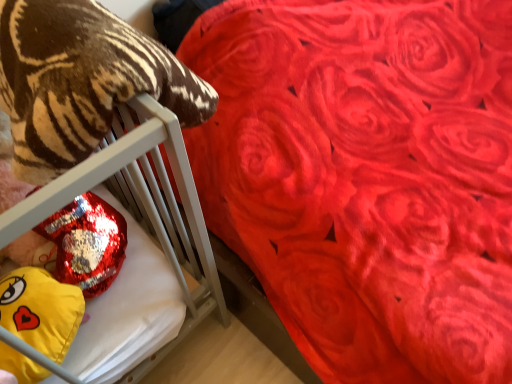
Question: From a real-world perspective, is yellow plush at left below soft plush tiger at left?

Choices:
 (A) yes
 (B) no

Answer: (A)

Question: Is yellow plush at left thinner than soft plush tiger at left?

Choices:
 (A) no
 (B) yes

Answer: (B)

Question: From the image's perspective, would you say yellow plush at left is positioned over soft plush tiger at left?

Choices:
 (A) no
 (B) yes

Answer: (A)

Question: Could you tell me if yellow plush at left is facing soft plush tiger at left?

Choices:
 (A) yes
 (B) no

Answer: (B)

Question: Can you confirm if yellow plush at left is bigger than soft plush tiger at left?

Choices:
 (A) yes
 (B) no

Answer: (B)

Question: From a real-world perspective, is soft plush tiger at left positioned above or below yellow plush at left?

Choices:
 (A) above
 (B) below

Answer: (A)

Question: Looking at their shapes, would you say soft plush tiger at left is wider or thinner than yellow plush at left?

Choices:
 (A) thin
 (B) wide

Answer: (B)

Question: In terms of size, does soft plush tiger at left appear bigger or smaller than yellow plush at left?

Choices:
 (A) small
 (B) big

Answer: (B)

Question: Considering the relative positions of soft plush tiger at left and yellow plush at left in the image provided, is soft plush tiger at left to the left or to the right of yellow plush at left?

Choices:
 (A) right
 (B) left

Answer: (A)

Question: Is point (125, 178) positioned closer to the camera than point (53, 279)?

Choices:
 (A) farther
 (B) closer

Answer: (A)

Question: Relative to yellow plush at left, is shiny metallic pillow at left in front or behind?

Choices:
 (A) front
 (B) behind

Answer: (B)

Question: In terms of size, does shiny metallic pillow at left appear bigger or smaller than yellow plush at left?

Choices:
 (A) small
 (B) big

Answer: (B)

Question: From a real-world perspective, is shiny metallic pillow at left physically located above or below yellow plush at left?

Choices:
 (A) below
 (B) above

Answer: (A)

Question: From the image's perspective, is yellow plush at left located above or below shiny metallic pillow at left?

Choices:
 (A) above
 (B) below

Answer: (B)

Question: In the image, is yellow plush at left positioned in front of or behind shiny metallic pillow at left?

Choices:
 (A) front
 (B) behind

Answer: (A)